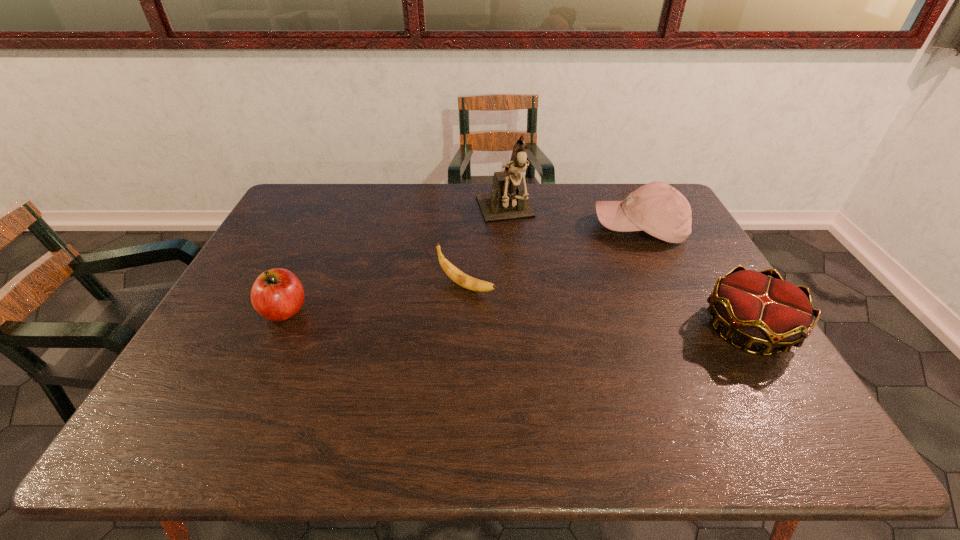
Where is `free space on the desktop that is between the apple and the crown and is positioned on the peel of the banana from the top`? This screenshot has width=960, height=540. free space on the desktop that is between the apple and the crown and is positioned on the peel of the banana from the top is located at coordinates (534, 320).

The height and width of the screenshot is (540, 960). In order to click on vacant space on the desktop that is between the leftmost object and the crown and is positioned on the front-facing side of the figurine in this screenshot , I will do `click(552, 321)`.

Where is `free spot on the desktop that is between the leftmost object and the crown and is positioned on the front-facing side of the fourth shortest object`? free spot on the desktop that is between the leftmost object and the crown and is positioned on the front-facing side of the fourth shortest object is located at coordinates (519, 320).